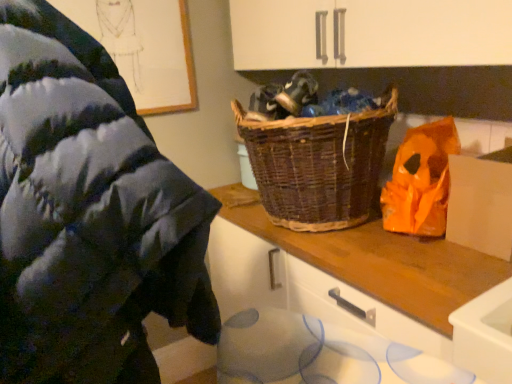
Question: Are woven brown picnic basket at center and white cardboard at right making contact?

Choices:
 (A) yes
 (B) no

Answer: (B)

Question: From the image's perspective, is woven brown picnic basket at center over white cardboard at right?

Choices:
 (A) yes
 (B) no

Answer: (A)

Question: Considering the relative sizes of woven brown picnic basket at center and white cardboard at right in the image provided, is woven brown picnic basket at center bigger than white cardboard at right?

Choices:
 (A) no
 (B) yes

Answer: (B)

Question: From a real-world perspective, is woven brown picnic basket at center physically below white cardboard at right?

Choices:
 (A) no
 (B) yes

Answer: (A)

Question: Can you confirm if woven brown picnic basket at center is smaller than white cardboard at right?

Choices:
 (A) no
 (B) yes

Answer: (A)

Question: Considering the relative positions of woven brown picnic basket at center and white cardboard at right in the image provided, is woven brown picnic basket at center to the left of white cardboard at right from the viewer's perspective?

Choices:
 (A) no
 (B) yes

Answer: (B)

Question: Can you confirm if white cardboard at right is thinner than woolen sweater at upper left?

Choices:
 (A) no
 (B) yes

Answer: (B)

Question: Is white cardboard at right facing towards woolen sweater at upper left?

Choices:
 (A) no
 (B) yes

Answer: (B)

Question: Does white cardboard at right contain woolen sweater at upper left?

Choices:
 (A) no
 (B) yes

Answer: (A)

Question: Is white cardboard at right smaller than woolen sweater at upper left?

Choices:
 (A) no
 (B) yes

Answer: (B)

Question: From a real-world perspective, is white cardboard at right below woolen sweater at upper left?

Choices:
 (A) yes
 (B) no

Answer: (B)

Question: Is white cardboard at right positioned in front of woolen sweater at upper left?

Choices:
 (A) yes
 (B) no

Answer: (B)

Question: Is woolen sweater at upper left positioned far away from orange plastic bag at right?

Choices:
 (A) no
 (B) yes

Answer: (A)